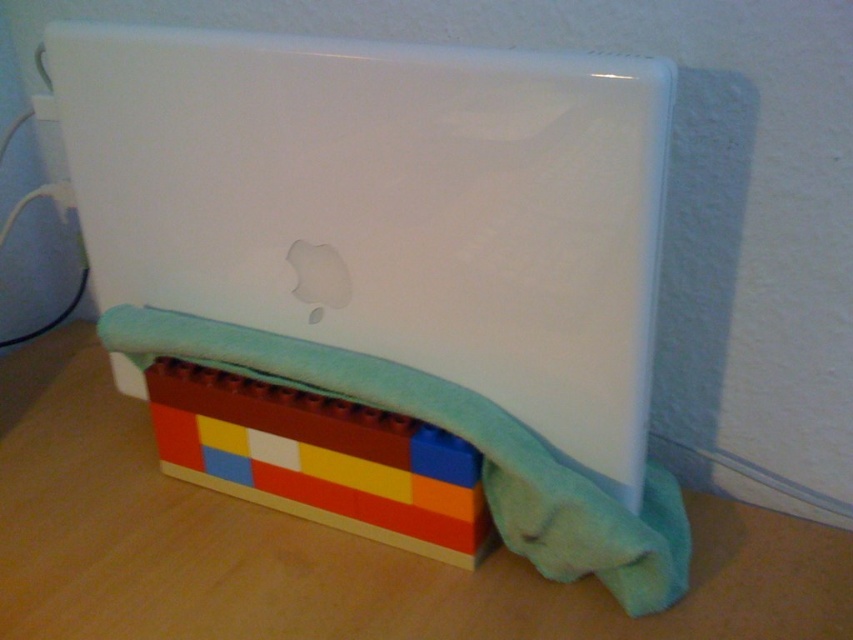
Question: Observing the image, what is the correct spatial positioning of wooden table at lower center in reference to multicolored plastic blocks at lower center?

Choices:
 (A) right
 (B) left

Answer: (B)

Question: Can you confirm if wooden table at lower center is wider than multicolored plastic blocks at lower center?

Choices:
 (A) no
 (B) yes

Answer: (B)

Question: Estimate the real-world distances between objects in this image. Which object is farther from the white glossy laptop at center?

Choices:
 (A) wooden table at lower center
 (B) multicolored plastic blocks at lower center

Answer: (A)

Question: Is white glossy laptop at center above multicolored plastic blocks at lower center?

Choices:
 (A) yes
 (B) no

Answer: (A)

Question: Among these objects, which one is farthest from the camera?

Choices:
 (A) multicolored plastic blocks at lower center
 (B) wooden table at lower center
 (C) white glossy laptop at center

Answer: (A)

Question: Which object appears farthest from the camera in this image?

Choices:
 (A) multicolored plastic blocks at lower center
 (B) white glossy laptop at center
 (C) wooden table at lower center

Answer: (A)